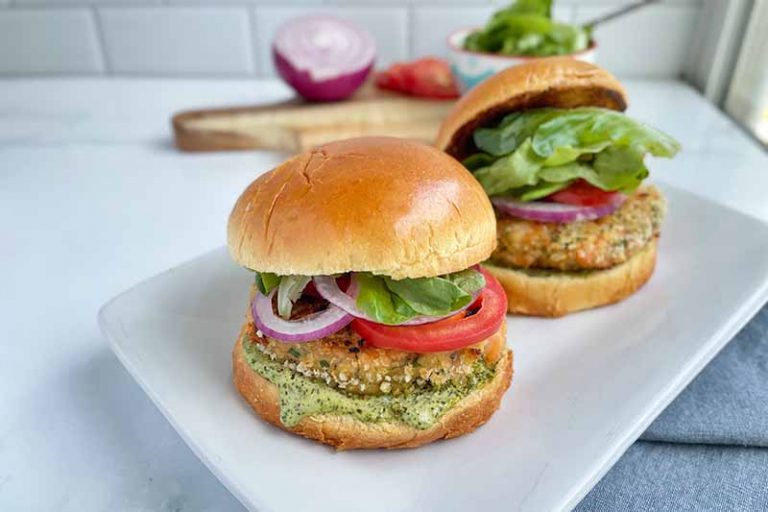
Identify the location of wooden cutting board. (270, 135).